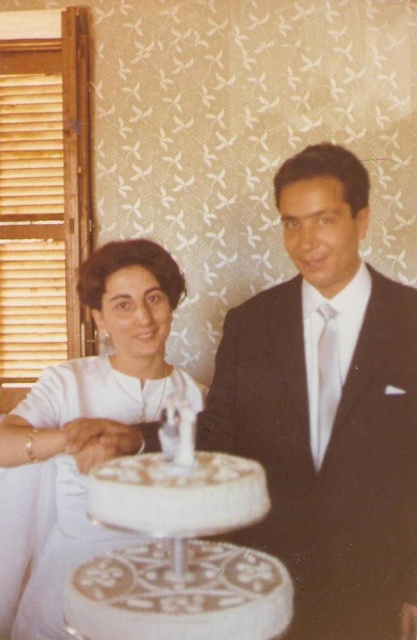
Does white frosted cake at center have a lesser width compared to white satin dress at center?

Correct, white frosted cake at center's width is less than white satin dress at center's.

Identify the location of white frosted cake at center. Image resolution: width=417 pixels, height=640 pixels. (178, 547).

Is the position of shiny black suit at center more distant than that of white satin dress at center?

Yes, shiny black suit at center is further from the viewer.

Who is taller, shiny black suit at center or white satin dress at center?

shiny black suit at center

I want to click on shiny black suit at center, so click(326, 408).

This screenshot has width=417, height=640. I want to click on shiny black suit at center, so (x=326, y=408).

Is shiny black suit at center closer to camera compared to white frosted cake at center?

No, it is not.

Describe the element at coordinates (326, 408) in the screenshot. The image size is (417, 640). I see `shiny black suit at center` at that location.

Identify the location of shiny black suit at center. (326, 408).